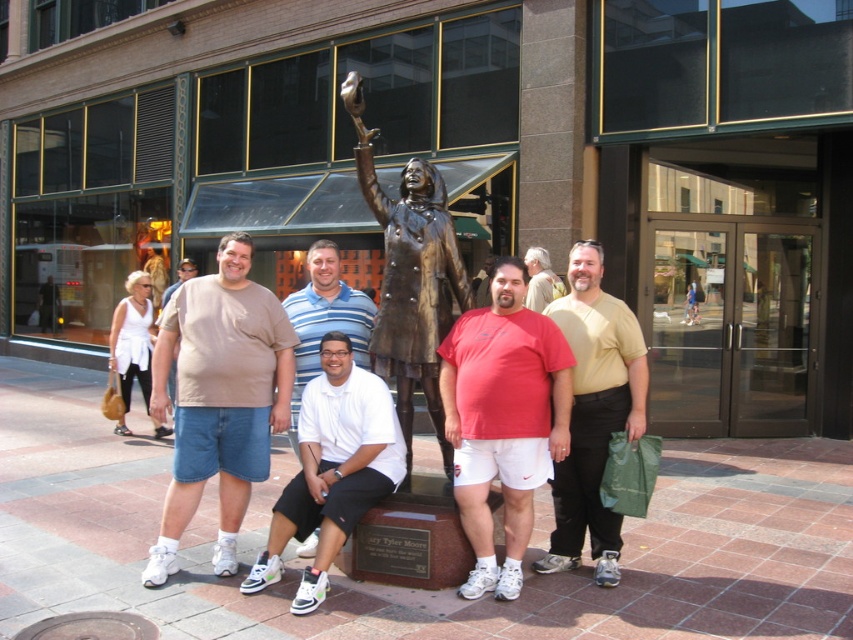
You are a photographer trying to capture a group photo where the white matte polo shirt at center and beige cotton shirt at center are clearly visible. Given their sizes, which one might you need to adjust your camera focus on to ensure it appears larger in the photo?

→ The white matte polo shirt at center is wider than the beige cotton shirt at center, so you should focus on the white matte polo shirt at center to make it appear larger in the photo.

You are a photographer who needs to adjust the lighting so that both the white matte polo shirt at center and the beige cotton shirt at center are equally visible. Given their sizes, which one might require more light to ensure visibility?

The white matte polo shirt at center is bigger than the beige cotton shirt at center, so it might require more light to ensure visibility since larger objects often need more illumination to be clearly seen.